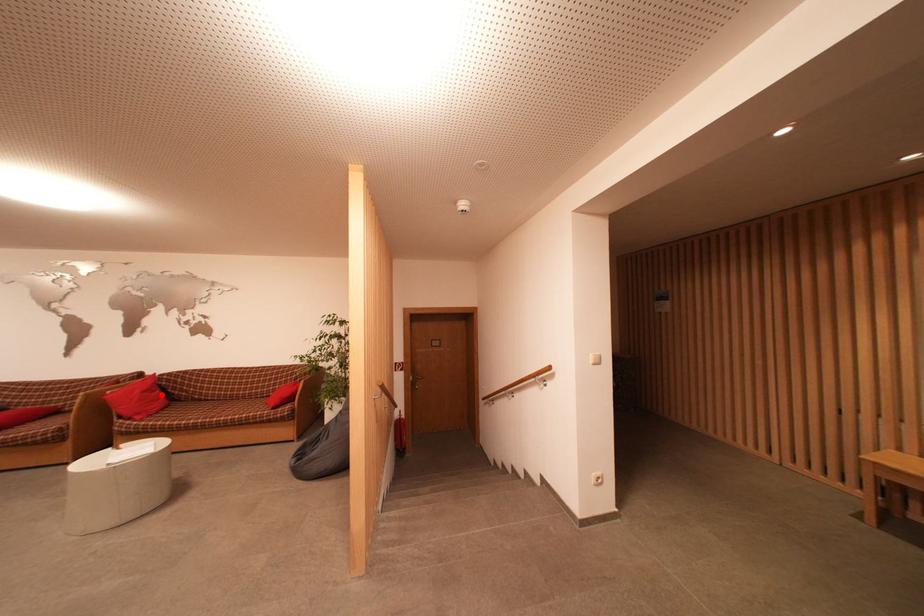
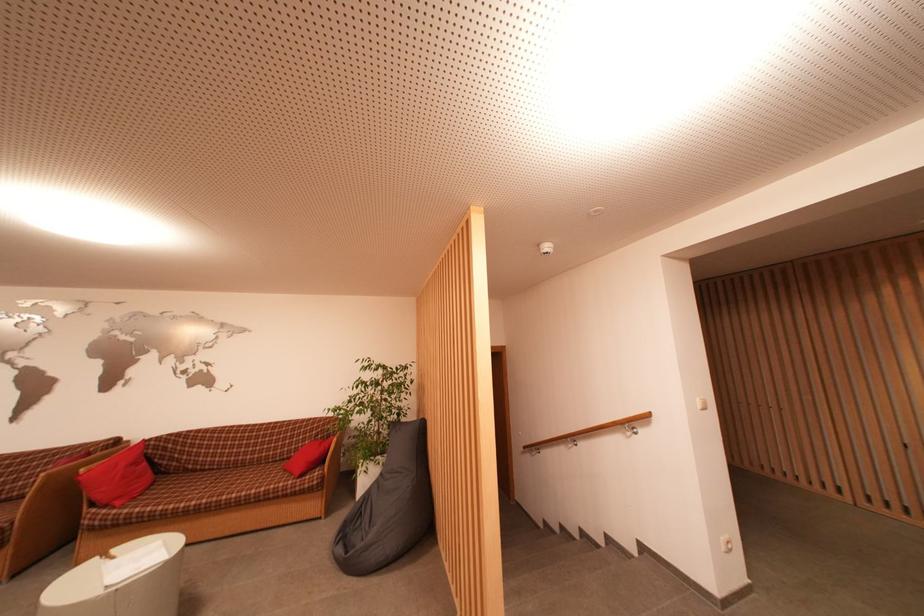
Question: I am providing you with two images of the same scene from different viewpoints. A red point is shown in image1. For the corresponding object point in image2, is it positioned nearer or farther from the camera?

Choices:
 (A) Nearer
 (B) Farther

Answer: (A)